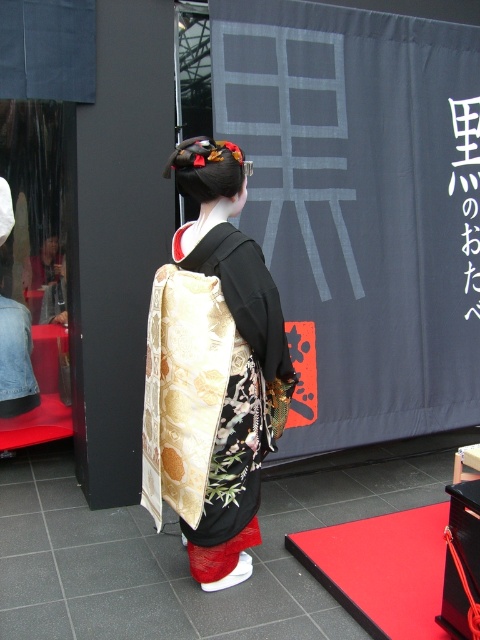
You are a photographer positioned in front of the scene. You notice two points marked in the image. The first point is at coordinate point (143, 456) and the second is at point (463, 100). Which of these two points is nearer to you?

Point (143, 456) is closer to the viewer than point (463, 100).

You are an event planner setting up for a cultural performance. You need to place a decorative item on the black paper at upper center. However, you want to ensure that the item won not block the view of the silky gold kimono at center from the audience seated in the front row. Is this possible?

The silky gold kimono at center is to the left of the black paper at upper center. Since the kimono is positioned to the left of the black paper, placing an item on the black paper at upper center would not obstruct the kimono from the front row audience as it is located to the right side of the kimono.

You are a stagehand setting up for a traditional Japanese performance. You need to place a decorative item on the largest surface available. Which object from the scene should you choose between the red carpet at lower right and the black paper at upper center?

The red carpet at lower right is bigger than the black paper at upper center, so you should place the decorative item on the red carpet at lower right.